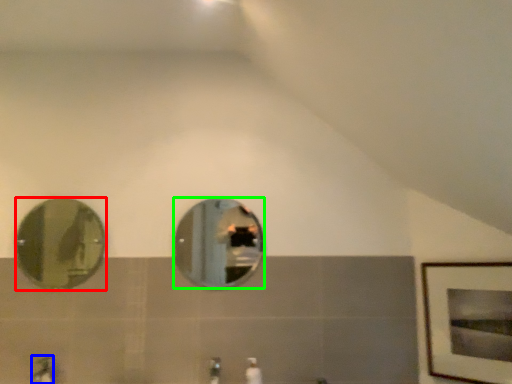
Question: Which is farther away from mirror (highlighted by a red box)? faucet (highlighted by a blue box) or mirror (highlighted by a green box)?

Choices:
 (A) faucet
 (B) mirror

Answer: (A)